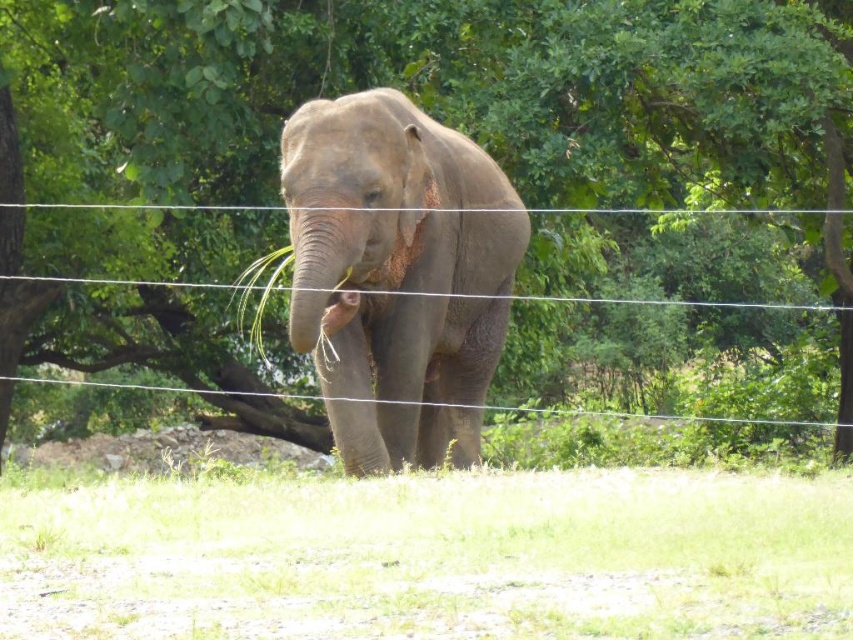
Is green leafy tree at center closer to camera compared to gray matte elephant at center?

No, green leafy tree at center is behind gray matte elephant at center.

Can you confirm if green leafy tree at center is wider than gray matte elephant at center?

Indeed, green leafy tree at center has a greater width compared to gray matte elephant at center.

Image resolution: width=853 pixels, height=640 pixels. Describe the element at coordinates (473, 90) in the screenshot. I see `green leafy tree at center` at that location.

Locate an element on the screen. The width and height of the screenshot is (853, 640). green leafy tree at center is located at coordinates (473, 90).

Is green grass at lower center shorter than gray matte elephant at center?

Yes, green grass at lower center is shorter than gray matte elephant at center.

Consider the image. Which of these two, green grass at lower center or gray matte elephant at center, stands shorter?

Standing shorter between the two is green grass at lower center.

Identify the location of green grass at lower center. (430, 556).

Does green leafy tree at center have a lesser width compared to green grass at lower center?

No, green leafy tree at center is not thinner than green grass at lower center.

In order to click on green leafy tree at center in this screenshot , I will do `click(473, 90)`.